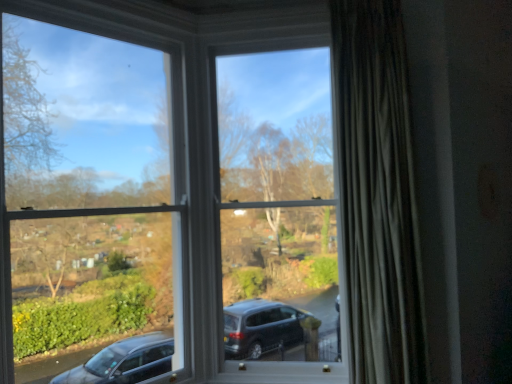
Question: Can you confirm if silky gray curtain at right is positioned to the left of white plastic window frame at upper left, which is counted as the first window frame, starting from the left?

Choices:
 (A) yes
 (B) no

Answer: (B)

Question: Does silky gray curtain at right come in front of white plastic window frame at upper left, which is the 2th window frame in right-to-left order?

Choices:
 (A) no
 (B) yes

Answer: (A)

Question: From the image's perspective, is silky gray curtain at right on top of white plastic window frame at upper left, which is the 2th window frame in right-to-left order?

Choices:
 (A) no
 (B) yes

Answer: (B)

Question: Is silky gray curtain at right taller than white plastic window frame at upper left, which is the 2th window frame in right-to-left order?

Choices:
 (A) no
 (B) yes

Answer: (B)

Question: Is silky gray curtain at right further to camera compared to white plastic window frame at upper left, which is the 2th window frame in right-to-left order?

Choices:
 (A) yes
 (B) no

Answer: (A)

Question: From the image's perspective, relative to white plastic window frame at upper left, which is the 2th window frame in right-to-left order, is silky gray curtain at right above or below?

Choices:
 (A) below
 (B) above

Answer: (B)

Question: Is silky gray curtain at right bigger or smaller than white plastic window frame at upper left, which is counted as the first window frame, starting from the left?

Choices:
 (A) small
 (B) big

Answer: (A)

Question: Is silky gray curtain at right inside the boundaries of white plastic window frame at upper left, which is counted as the first window frame, starting from the left, or outside?

Choices:
 (A) inside
 (B) outside

Answer: (B)

Question: In the image, is silky gray curtain at right positioned in front of or behind white plastic window frame at upper left, which is the 2th window frame in right-to-left order?

Choices:
 (A) behind
 (B) front

Answer: (A)

Question: From the image's perspective, is silky gray curtain at right located above or below white plastic window frame at center, which appears as the 2th window frame when viewed from the left?

Choices:
 (A) above
 (B) below

Answer: (A)

Question: In the image, is silky gray curtain at right on the left side or the right side of white plastic window frame at center, which appears as the 2th window frame when viewed from the left?

Choices:
 (A) right
 (B) left

Answer: (A)

Question: From a real-world perspective, relative to white plastic window frame at center, which appears as the 2th window frame when viewed from the left, is silky gray curtain at right vertically above or below?

Choices:
 (A) below
 (B) above

Answer: (B)

Question: In terms of width, does silky gray curtain at right look wider or thinner when compared to white plastic window frame at center, the first window frame viewed from the right?

Choices:
 (A) wide
 (B) thin

Answer: (A)

Question: From a real-world perspective, relative to white plastic window frame at center, which appears as the 2th window frame when viewed from the left, is white plastic window frame at upper left, which is counted as the first window frame, starting from the left, vertically above or below?

Choices:
 (A) below
 (B) above

Answer: (A)

Question: From the image's perspective, relative to white plastic window frame at center, which appears as the 2th window frame when viewed from the left, is white plastic window frame at upper left, which is the 2th window frame in right-to-left order, above or below?

Choices:
 (A) below
 (B) above

Answer: (A)